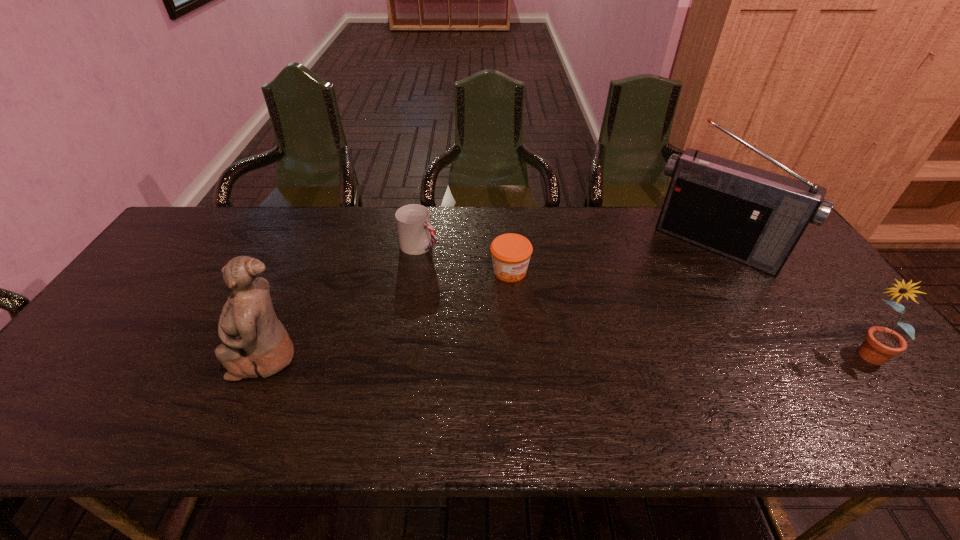
Where is `vacant space that is in between the leftmost object and the tallest object`? vacant space that is in between the leftmost object and the tallest object is located at coordinates (492, 301).

Find the location of a particular element. unoccupied position between the tallest object and the sunflower is located at coordinates (789, 301).

Find the location of `free space between the tallest object and the leftmost object`. free space between the tallest object and the leftmost object is located at coordinates (492, 301).

At what (x,y) coordinates should I click in order to perform the action: click on the third closest object to the sunflower. Please return your answer as a coordinate pair (x, y). The width and height of the screenshot is (960, 540). Looking at the image, I should click on (416, 235).

The height and width of the screenshot is (540, 960). Find the location of `object identified as the second closest to the leftmost object`. object identified as the second closest to the leftmost object is located at coordinates coord(511,253).

Find the location of `free space that satisfies the following two spatial constraints: 1. on the front side of the sunflower; 2. on the flower of the second shortest object`. free space that satisfies the following two spatial constraints: 1. on the front side of the sunflower; 2. on the flower of the second shortest object is located at coordinates (402, 356).